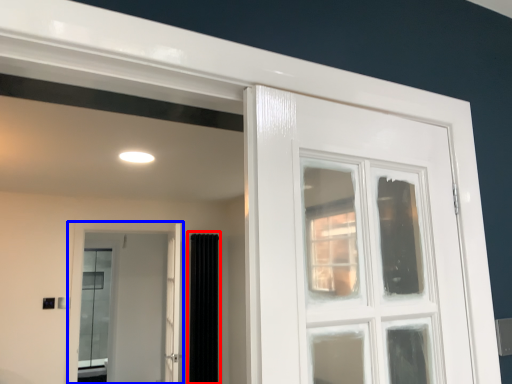
Question: Among these objects, which one is farthest to the camera, curtain (highlighted by a red box) or door (highlighted by a blue box)?

Choices:
 (A) curtain
 (B) door

Answer: (A)